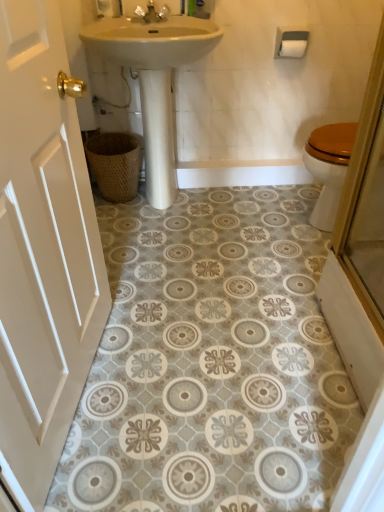
Question: From the image's perspective, does white painted wood door at left appear lower than white matte toilet paper at upper right?

Choices:
 (A) yes
 (B) no

Answer: (A)

Question: Is white painted wood door at left positioned far away from white matte toilet paper at upper right?

Choices:
 (A) yes
 (B) no

Answer: (A)

Question: From a real-world perspective, is white painted wood door at left physically above white matte toilet paper at upper right?

Choices:
 (A) yes
 (B) no

Answer: (B)

Question: From the image's perspective, is white painted wood door at left over white matte toilet paper at upper right?

Choices:
 (A) yes
 (B) no

Answer: (B)

Question: Is white painted wood door at left surrounding white matte toilet paper at upper right?

Choices:
 (A) yes
 (B) no

Answer: (B)

Question: Considering the relative sizes of white painted wood door at left and white matte toilet paper at upper right in the image provided, is white painted wood door at left shorter than white matte toilet paper at upper right?

Choices:
 (A) no
 (B) yes

Answer: (A)

Question: Considering the relative sizes of woven brown basket at lower left and matte gold faucet at upper center in the image provided, is woven brown basket at lower left thinner than matte gold faucet at upper center?

Choices:
 (A) yes
 (B) no

Answer: (B)

Question: From a real-world perspective, is woven brown basket at lower left on matte gold faucet at upper center?

Choices:
 (A) no
 (B) yes

Answer: (A)

Question: Is matte gold faucet at upper center inside woven brown basket at lower left?

Choices:
 (A) no
 (B) yes

Answer: (A)

Question: From the image's perspective, does woven brown basket at lower left appear lower than matte gold faucet at upper center?

Choices:
 (A) no
 (B) yes

Answer: (B)

Question: Is woven brown basket at lower left aimed at matte gold faucet at upper center?

Choices:
 (A) yes
 (B) no

Answer: (B)

Question: Does woven brown basket at lower left have a greater width compared to matte gold faucet at upper center?

Choices:
 (A) no
 (B) yes

Answer: (B)

Question: Is white painted wood door at left thinner than woven brown basket at lower left?

Choices:
 (A) no
 (B) yes

Answer: (B)